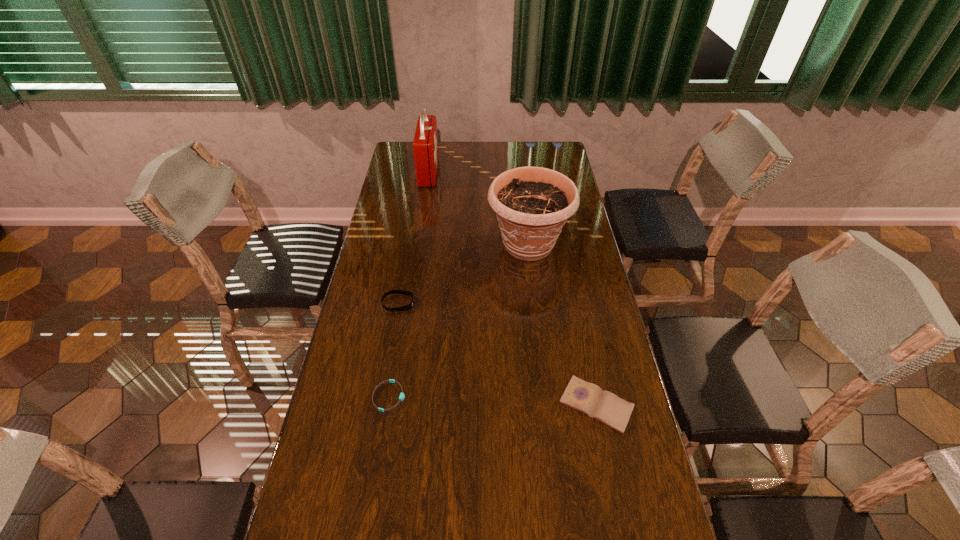
Where is `vacant space at the right edge`? vacant space at the right edge is located at coordinates (576, 241).

In the image, there is a desktop. Where is `blank space at the far right corner`? blank space at the far right corner is located at coordinates (542, 165).

Where is `vacant area that lies between the farthest object and the taller wristband`? The width and height of the screenshot is (960, 540). vacant area that lies between the farthest object and the taller wristband is located at coordinates (414, 238).

Find the location of `vacant space in between the fourth nearest object and the third nearest object`. vacant space in between the fourth nearest object and the third nearest object is located at coordinates (464, 274).

This screenshot has height=540, width=960. What are the coordinates of `vacant area that lies between the second shortest object and the taller wristband` in the screenshot? It's located at (497, 354).

You are a GUI agent. You are given a task and a screenshot of the screen. Output one action in this format:
    pyautogui.click(x=<x>, y=<y>)
    Task: Click on the free point between the flowerpot and the farthest object
    The height and width of the screenshot is (540, 960).
    Given the screenshot: What is the action you would take?
    pyautogui.click(x=479, y=209)

Identify the location of empty space between the farther wristband and the first-aid kit. (414, 238).

Where is `free space that is in between the second farthest object and the taller wristband`? The height and width of the screenshot is (540, 960). free space that is in between the second farthest object and the taller wristband is located at coordinates (464, 274).

Locate an element on the screen. The image size is (960, 540). free space between the taller wristband and the farthest object is located at coordinates (414, 238).

Where is `blank region between the farther wristband and the fourth shortest object`? The height and width of the screenshot is (540, 960). blank region between the farther wristband and the fourth shortest object is located at coordinates (464, 274).